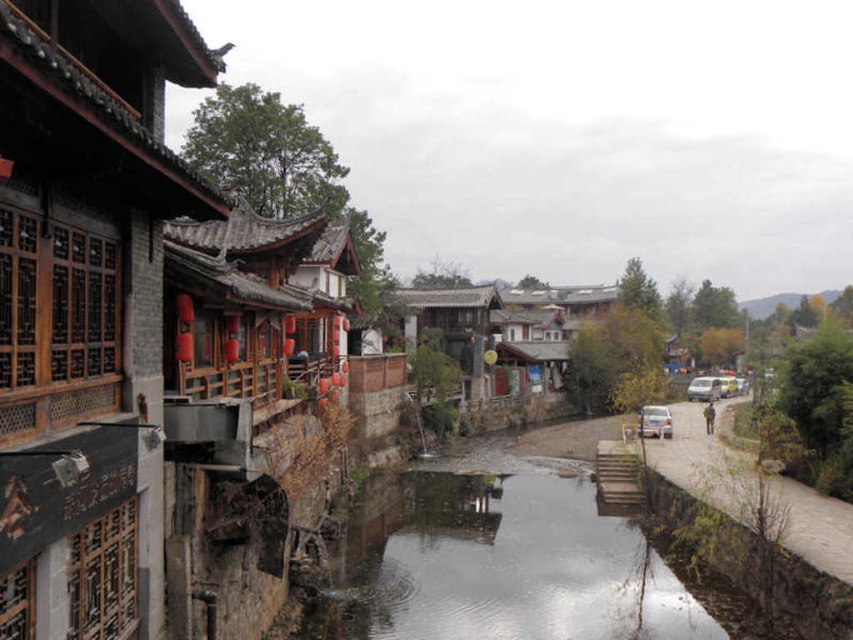
Question: Can you confirm if clear concrete river at center is positioned to the left of white matte car at center?

Choices:
 (A) yes
 (B) no

Answer: (A)

Question: Which of the following is the closest to the observer?

Choices:
 (A) (583, 550)
 (B) (648, 413)

Answer: (A)

Question: Is clear concrete river at center positioned at the back of white matte car at center?

Choices:
 (A) yes
 (B) no

Answer: (B)

Question: Does clear concrete river at center have a greater width compared to white matte car at center?

Choices:
 (A) yes
 (B) no

Answer: (A)